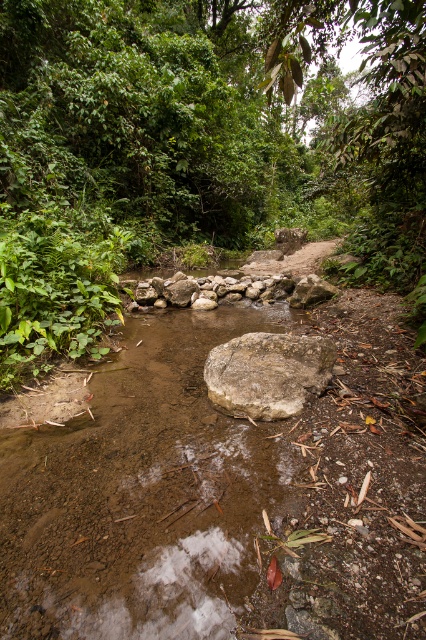
Consider the image. You are standing at the edge of the stream in the forest scene. You notice two points marked in the image. Which point, point [284,353] or point [328,292], is closer to you?

Point [284,353] is closer to the viewer than point [328,292].

You are a hiker trying to cross the stream in the forest. You see a gray rough rock at center and a natural stone at center. Which one is lower in elevation?

The gray rough rock at center is below the natural stone at center, so it is lower in elevation.